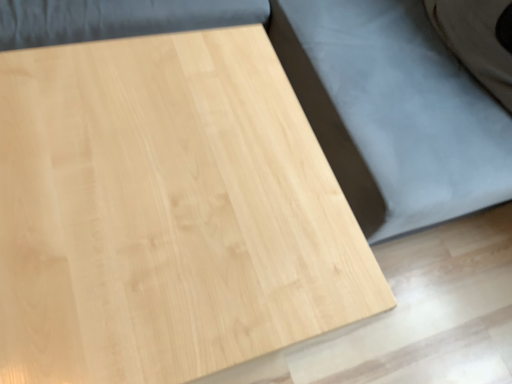
Question: Is light wood table at center taller or shorter than natural wood bed frame at center?

Choices:
 (A) tall
 (B) short

Answer: (B)

Question: From the image's perspective, is light wood table at center positioned above or below natural wood bed frame at center?

Choices:
 (A) below
 (B) above

Answer: (A)

Question: Considering the positions of light wood table at center and natural wood bed frame at center in the image, is light wood table at center bigger or smaller than natural wood bed frame at center?

Choices:
 (A) big
 (B) small

Answer: (B)

Question: From a real-world perspective, is natural wood bed frame at center above or below light wood table at center?

Choices:
 (A) above
 (B) below

Answer: (A)

Question: Which is correct: natural wood bed frame at center is inside light wood table at center, or outside of it?

Choices:
 (A) outside
 (B) inside

Answer: (A)

Question: From the image's perspective, is natural wood bed frame at center located above or below light wood table at center?

Choices:
 (A) below
 (B) above

Answer: (B)

Question: In the image, is natural wood bed frame at center positioned in front of or behind light wood table at center?

Choices:
 (A) front
 (B) behind

Answer: (B)